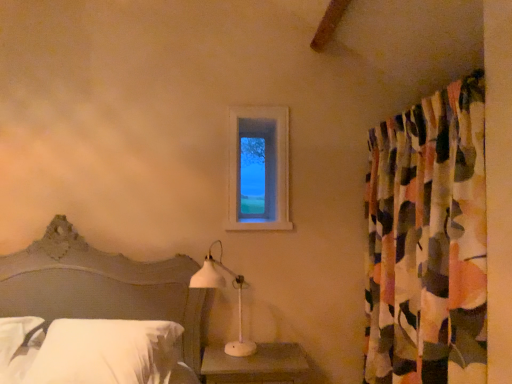
Question: Are white plastic table lamp at lower center and white soft pillow at lower left located far from each other?

Choices:
 (A) no
 (B) yes

Answer: (A)

Question: Is white soft pillow at lower left completely or partially inside white plastic table lamp at lower center?

Choices:
 (A) yes
 (B) no

Answer: (B)

Question: Considering the relative sizes of white plastic table lamp at lower center and white soft pillow at lower left in the image provided, is white plastic table lamp at lower center smaller than white soft pillow at lower left?

Choices:
 (A) yes
 (B) no

Answer: (A)

Question: Is white plastic table lamp at lower center next to white soft pillow at lower left and touching it?

Choices:
 (A) no
 (B) yes

Answer: (A)

Question: Is white plastic table lamp at lower center aimed at white soft pillow at lower left?

Choices:
 (A) yes
 (B) no

Answer: (B)

Question: Is point (305, 370) positioned closer to the camera than point (247, 218)?

Choices:
 (A) closer
 (B) farther

Answer: (A)

Question: Would you say matte white wood nightstand at lower center is inside or outside clear glass window at upper center?

Choices:
 (A) outside
 (B) inside

Answer: (A)

Question: Considering the positions of matte white wood nightstand at lower center and clear glass window at upper center in the image, is matte white wood nightstand at lower center taller or shorter than clear glass window at upper center?

Choices:
 (A) tall
 (B) short

Answer: (B)

Question: Considering the positions of matte white wood nightstand at lower center and clear glass window at upper center in the image, is matte white wood nightstand at lower center wider or thinner than clear glass window at upper center?

Choices:
 (A) wide
 (B) thin

Answer: (A)

Question: Is point (6, 289) closer or farther from the camera than point (238, 331)?

Choices:
 (A) closer
 (B) farther

Answer: (A)

Question: In the image, is matte gray headboard at lower left on the left side or the right side of white plastic table lamp at lower center?

Choices:
 (A) left
 (B) right

Answer: (A)

Question: From the image's perspective, is matte gray headboard at lower left positioned above or below white plastic table lamp at lower center?

Choices:
 (A) below
 (B) above

Answer: (A)

Question: Choose the correct answer: Is matte gray headboard at lower left inside white plastic table lamp at lower center or outside it?

Choices:
 (A) outside
 (B) inside

Answer: (A)

Question: In the image, is white soft pillow at lower left positioned in front of or behind multicolored fabric curtain at right?

Choices:
 (A) behind
 (B) front

Answer: (A)

Question: From their relative heights in the image, would you say white soft pillow at lower left is taller or shorter than multicolored fabric curtain at right?

Choices:
 (A) tall
 (B) short

Answer: (B)